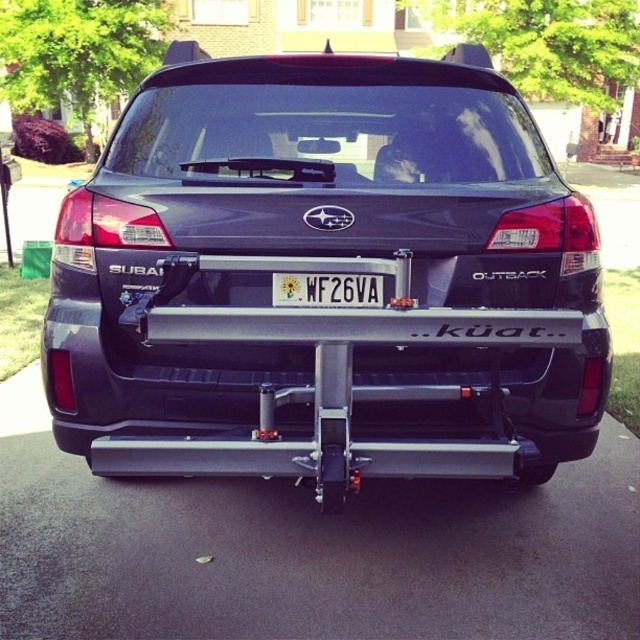
Question: Can you confirm if metallic gray hitch at center is thinner than white plastic license plate at center?

Choices:
 (A) yes
 (B) no

Answer: (B)

Question: Is metallic gray hitch at center positioned at the back of white plastic license plate at center?

Choices:
 (A) no
 (B) yes

Answer: (A)

Question: Which of the following is the farthest from the observer?

Choices:
 (A) metallic gray hitch at center
 (B) white plastic license plate at center

Answer: (B)

Question: Which object is closer to the camera taking this photo?

Choices:
 (A) metallic gray hitch at center
 (B) white plastic license plate at center

Answer: (A)

Question: Does metallic gray hitch at center have a smaller size compared to white plastic license plate at center?

Choices:
 (A) yes
 (B) no

Answer: (B)

Question: Which point is farther to the camera?

Choices:
 (A) white plastic license plate at center
 (B) metallic gray hitch at center

Answer: (A)